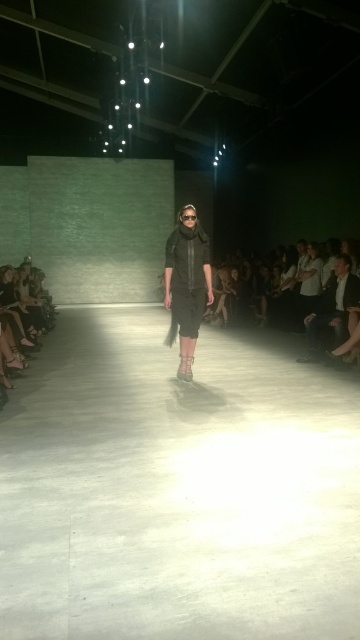
Is black matte dress at center in front of dark gray jeans at right?

Yes, black matte dress at center is in front of dark gray jeans at right.

Does point (195, 264) lie behind point (336, 337)?

No, it is in front of (336, 337).

Locate an element on the screen. black matte dress at center is located at coordinates (186, 284).